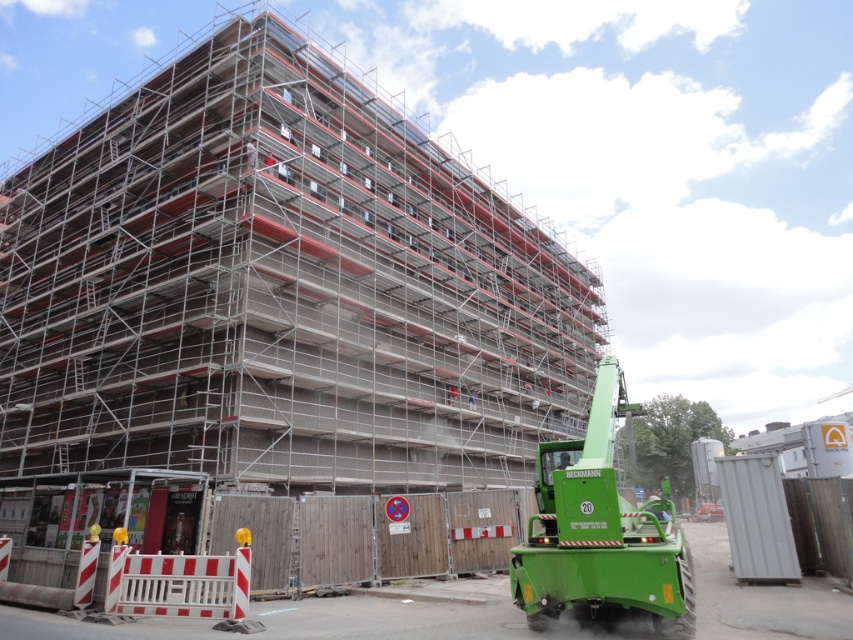
Question: Does green metallic crane at lower right come behind red and white plastic barricade at lower left?

Choices:
 (A) no
 (B) yes

Answer: (A)

Question: Among these objects, which one is nearest to the camera?

Choices:
 (A) red and white plastic barricade at lower left
 (B) green metallic crane at lower right
 (C) silver metallic scaffolding at center

Answer: (B)

Question: Considering the relative positions of silver metallic scaffolding at center and red and white plastic barricade at lower left in the image provided, where is silver metallic scaffolding at center located with respect to red and white plastic barricade at lower left?

Choices:
 (A) below
 (B) above

Answer: (B)

Question: Can you confirm if silver metallic scaffolding at center is positioned to the left of red and white plastic barricade at lower left?

Choices:
 (A) yes
 (B) no

Answer: (B)

Question: Which point appears closest to the camera in this image?

Choices:
 (A) click(196, 600)
 (B) click(553, 563)

Answer: (B)

Question: Which point is closer to the camera?

Choices:
 (A) silver metallic scaffolding at center
 (B) red and white plastic barricade at lower left

Answer: (B)